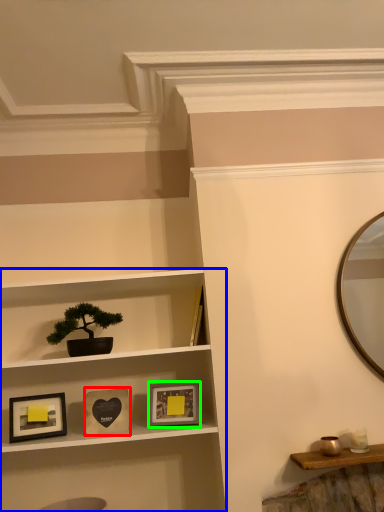
Question: Which object is the closest to the picture frame (highlighted by a red box)? Choose among these: shelf (highlighted by a blue box) or picture frame (highlighted by a green box).

Choices:
 (A) shelf
 (B) picture frame

Answer: (B)